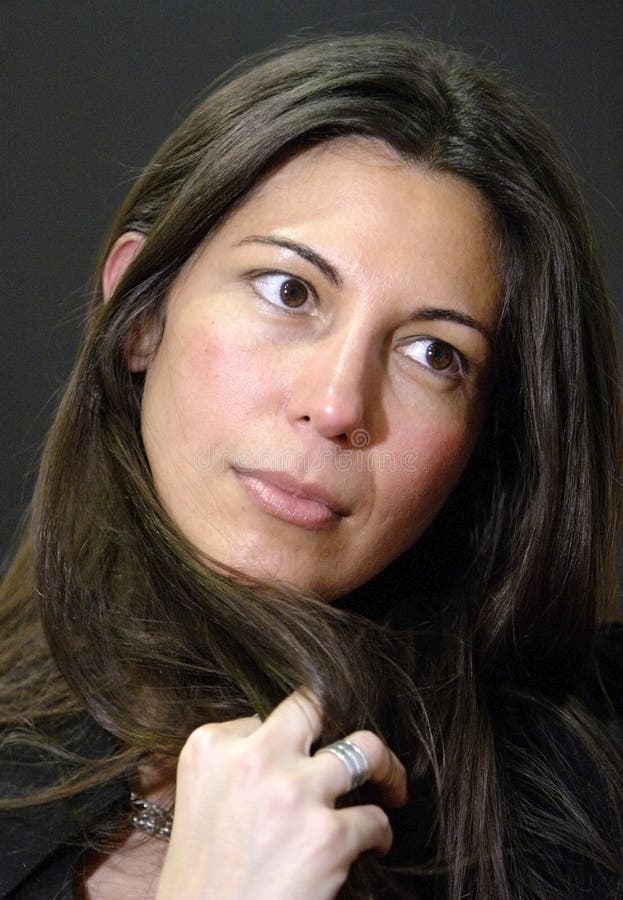
Find the location of a particular element. wall is located at coordinates (97, 149).